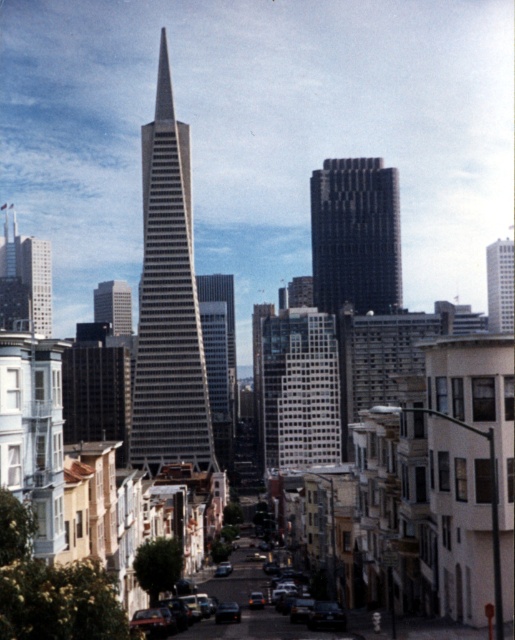
Is silver glass skyscraper at center shorter than glassy silver skyscraper at center?

In fact, silver glass skyscraper at center may be taller than glassy silver skyscraper at center.

Between silver glass skyscraper at center and glassy silver skyscraper at center, which one appears on the left side from the viewer's perspective?

From the viewer's perspective, glassy silver skyscraper at center appears more on the left side.

Is point (145, 314) closer to viewer compared to point (101, 291)?

Yes, point (145, 314) is closer to viewer.

You are a GUI agent. You are given a task and a screenshot of the screen. Output one action in this format:
    pyautogui.click(x=<x>, y=<y>)
    Task: Click on the silver glass skyscraper at center
    
    Given the screenshot: What is the action you would take?
    pyautogui.click(x=168, y=301)

Is glassy silver skyscraper at center to the right of shiny black sedan at center from the viewer's perspective?

No, glassy silver skyscraper at center is not to the right of shiny black sedan at center.

Measure the distance between point (103,282) and camera.

They are 686.15 meters apart.

The width and height of the screenshot is (515, 640). Identify the location of glassy silver skyscraper at center. (113, 305).

Between point (227, 317) and point (219, 611), which one is positioned behind?

The point (227, 317) is behind.

Who is positioned more to the left, glassy reflective skyscraper at center or shiny black sedan at center?

glassy reflective skyscraper at center

You are a GUI agent. You are given a task and a screenshot of the screen. Output one action in this format:
    pyautogui.click(x=<x>, y=<y>)
    Task: Click on the glassy reflective skyscraper at center
    The height and width of the screenshot is (640, 515).
    Given the screenshot: What is the action you would take?
    pyautogui.click(x=227, y=323)